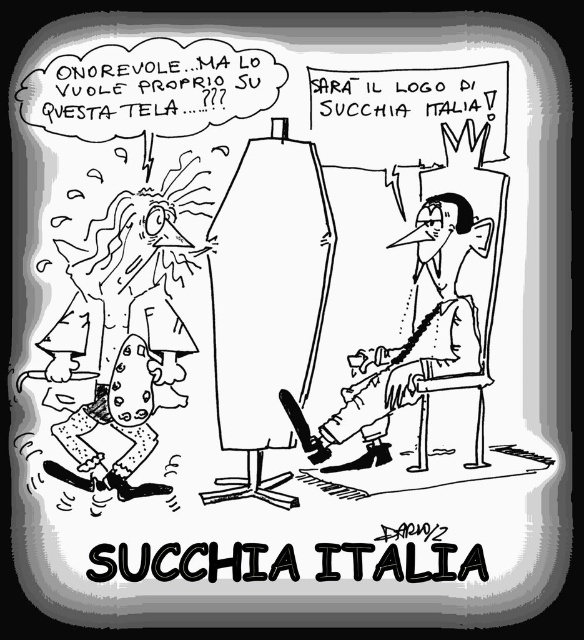
Question: Which of the following is the farthest from the observer?

Choices:
 (A) (471, 360)
 (B) (114, 385)

Answer: (A)

Question: Does smooth skin man at center have a greater width compared to speckled fabric pants at lower left?

Choices:
 (A) no
 (B) yes

Answer: (B)

Question: Can you confirm if smooth skin man at center is positioned above speckled fabric pants at lower left?

Choices:
 (A) no
 (B) yes

Answer: (B)

Question: Which point is closer to the camera?

Choices:
 (A) (50, 465)
 (B) (451, 349)

Answer: (A)

Question: Can you confirm if smooth skin man at center is bigger than speckled fabric pants at lower left?

Choices:
 (A) no
 (B) yes

Answer: (B)

Question: Which object is closer to the camera taking this photo?

Choices:
 (A) speckled fabric pants at lower left
 (B) smooth skin man at center

Answer: (A)